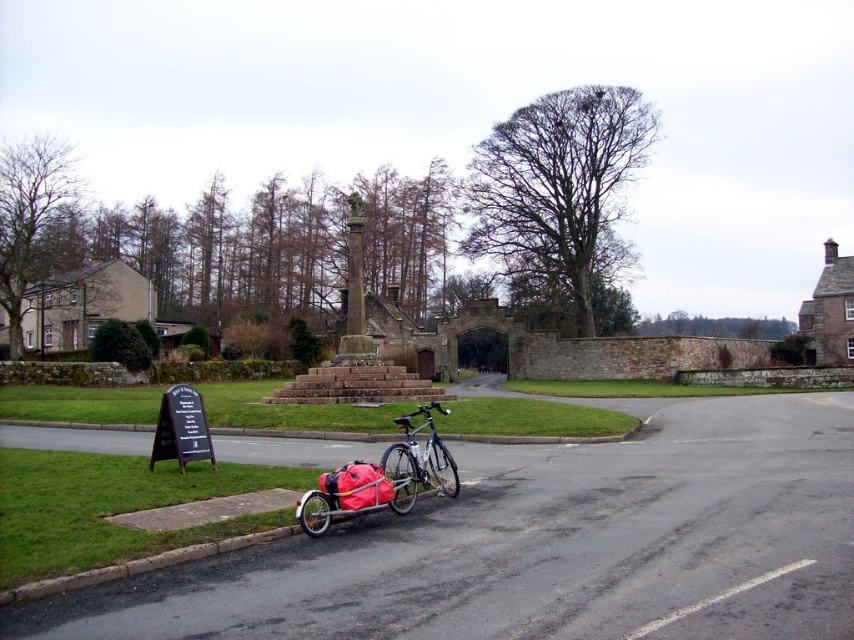
You are a delivery person trying to park your bicycle between two others in the scene. The silver metallic bicycle at lower center and the silver metallic bicycle at center are already parked. Which bicycle should you park behind to ensure your delivery bike is closest to the road?

You should park behind the silver metallic bicycle at center because the silver metallic bicycle at lower center is in front of it, meaning the silver metallic bicycle at center is further back and closer to the road.

You are a tourist standing at the intersection of the paved road and the grassy area. You see a silver metallic bicycle at lower center and a silver metallic bicycle at center. Which bicycle is positioned higher up in the image?

The silver metallic bicycle at lower center is positioned higher up in the image than the silver metallic bicycle at center.